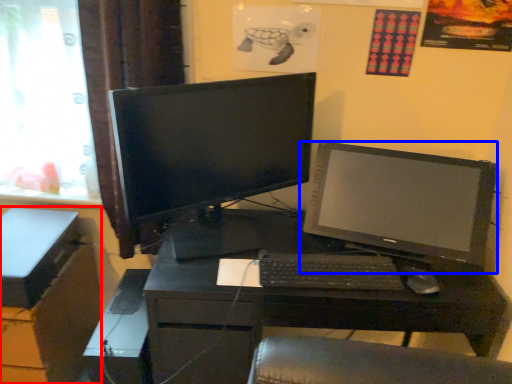
Question: Which point is closer to the camera, file cabinet (highlighted by a red box) or computer monitor (highlighted by a blue box)?

Choices:
 (A) file cabinet
 (B) computer monitor

Answer: (B)